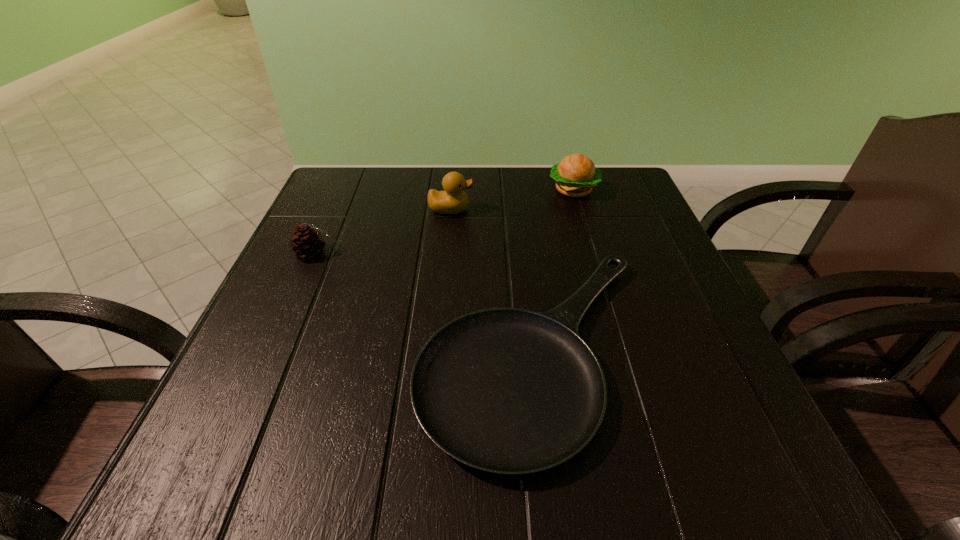
Find the location of `free space that satisfies the following two spatial constraints: 1. with a leaf charm attached to the leftmost object; 2. on the back side of the frying pan`. free space that satisfies the following two spatial constraints: 1. with a leaf charm attached to the leftmost object; 2. on the back side of the frying pan is located at coordinates (271, 349).

Where is `free space that satisfies the following two spatial constraints: 1. with a leaf charm attached to the second shortest object; 2. on the right side of the nearest object`? free space that satisfies the following two spatial constraints: 1. with a leaf charm attached to the second shortest object; 2. on the right side of the nearest object is located at coordinates (271, 349).

Where is `vacant space that satisfies the following two spatial constraints: 1. on the back side of the nearest object; 2. on the face of the duckling`? vacant space that satisfies the following two spatial constraints: 1. on the back side of the nearest object; 2. on the face of the duckling is located at coordinates (519, 209).

You are a GUI agent. You are given a task and a screenshot of the screen. Output one action in this format:
    pyautogui.click(x=<x>, y=<y>)
    Task: Click on the vacant region that satisfies the following two spatial constraints: 1. on the face of the duckling; 2. on the right side of the nearest object
    This screenshot has height=540, width=960.
    Given the screenshot: What is the action you would take?
    pyautogui.click(x=438, y=349)

You are a GUI agent. You are given a task and a screenshot of the screen. Output one action in this format:
    pyautogui.click(x=<x>, y=<y>)
    Task: Click on the free space that satisfies the following two spatial constraints: 1. on the face of the duckling; 2. on the left side of the frying pan
    The height and width of the screenshot is (540, 960).
    Given the screenshot: What is the action you would take?
    pyautogui.click(x=438, y=349)